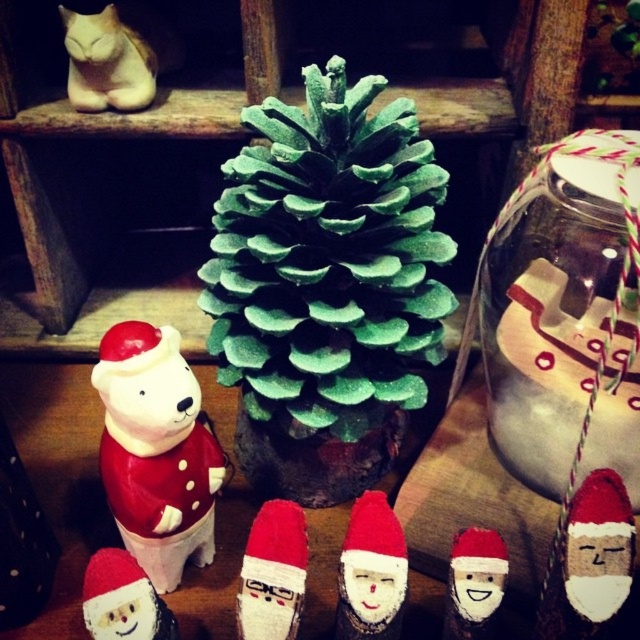
You are setting up a holiday display and want to ensure the green glittery pinecone at center is visible above the matte wood santa at center. Based on the scene description, will the pinecone be taller than the Santa figure?

Yes, the green glittery pinecone at center is taller than the matte wood santa at center according to the description.

You are standing in front of the festive arrangement and want to place a new decoration exactly at the point specified by the coordinates point (326, 285). According to the scene description, where will this decoration be placed relative to the green glittery pinecone at center?

The point (326, 285) is on the green glittery pinecone at center, so placing the decoration there will position it directly on top of the pinecone.

You are setting up a display and need to place a small ornament between the matte white bear at center left and the matte wood santa at center. Based on their positions, where should you place the ornament?

The matte white bear at center left is positioned over the matte wood santa at center, so you should place the ornament between them, ensuring it sits below the bear and above the santa to maintain the spatial arrangement.